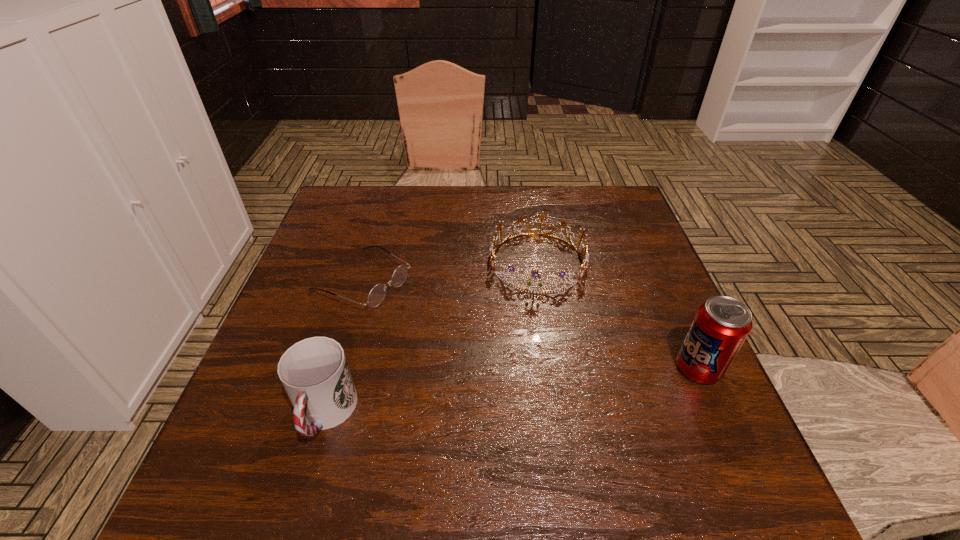
Where is `free location located 0.100m through the lenses of the spectacles`? The height and width of the screenshot is (540, 960). free location located 0.100m through the lenses of the spectacles is located at coordinates (433, 315).

Where is `free space located 0.310m through the lenses of the spectacles`? This screenshot has width=960, height=540. free space located 0.310m through the lenses of the spectacles is located at coordinates (513, 355).

What are the coordinates of `vacant space located 0.180m through the lenses of the spectacles` in the screenshot? It's located at (462, 329).

At what (x,y) coordinates should I click in order to perform the action: click on object situated at the near edge. Please return your answer as a coordinate pair (x, y). Looking at the image, I should click on (314, 372).

The width and height of the screenshot is (960, 540). I want to click on cup that is at the left edge, so click(x=314, y=372).

This screenshot has height=540, width=960. Find the location of `spectacles located in the left edge section of the desktop`. spectacles located in the left edge section of the desktop is located at coordinates (378, 292).

Where is `object located in the right edge section of the desktop`? This screenshot has height=540, width=960. object located in the right edge section of the desktop is located at coordinates (721, 325).

This screenshot has height=540, width=960. In order to click on object situated at the near left corner in this screenshot , I will do `click(314, 372)`.

Where is `free region at the far edge of the desktop`? free region at the far edge of the desktop is located at coordinates (538, 222).

Where is `vacant space at the near edge of the desktop`? This screenshot has height=540, width=960. vacant space at the near edge of the desktop is located at coordinates (598, 446).